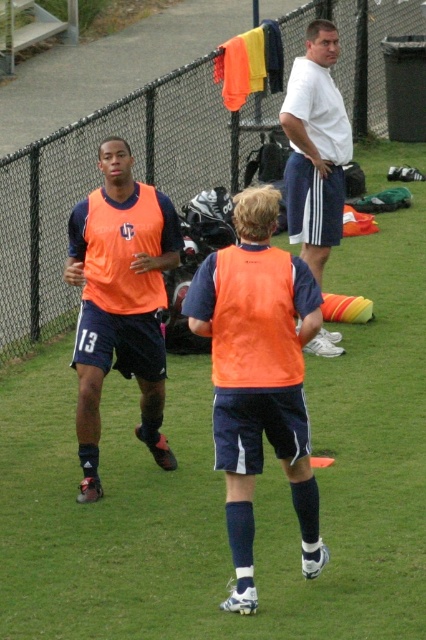
Question: Which point is closer to the camera?

Choices:
 (A) (245, 458)
 (B) (69, 193)

Answer: (A)

Question: Which object is the closest to the white cotton shirt at upper center?

Choices:
 (A) metallic chain-link fence at upper center
 (B) matte orange vest at center

Answer: (B)

Question: Does metallic chain-link fence at upper center come in front of white cotton shirt at upper center?

Choices:
 (A) no
 (B) yes

Answer: (A)

Question: Which object is the closest to the white cotton shirt at upper center?

Choices:
 (A) matte orange vest at center
 (B) metallic chain-link fence at upper center
 (C) orange matte vest at center

Answer: (A)

Question: Can you confirm if metallic chain-link fence at upper center is thinner than matte orange vest at center?

Choices:
 (A) no
 (B) yes

Answer: (A)

Question: Where is metallic chain-link fence at upper center located in relation to white cotton shirt at upper center in the image?

Choices:
 (A) right
 (B) left

Answer: (B)